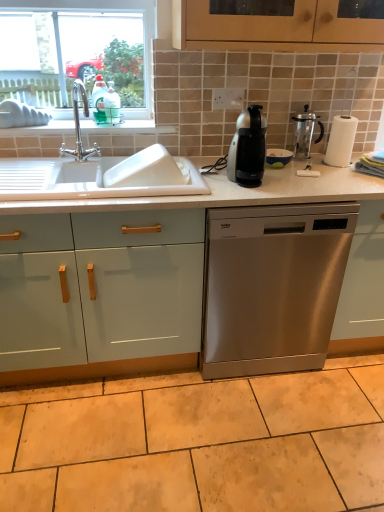
Describe the element at coordinates (199, 443) in the screenshot. I see `beige ceramic tile at lower center` at that location.

You are a GUI agent. You are given a task and a screenshot of the screen. Output one action in this format:
    pyautogui.click(x=<x>, y=<y>)
    Task: Click on the translucent plastic bottle at upper left
    The width and height of the screenshot is (384, 512).
    Given the screenshot: What is the action you would take?
    pyautogui.click(x=105, y=102)

Where is `mint glossy cabinet doors at lower left`? mint glossy cabinet doors at lower left is located at coordinates (100, 295).

Considering the relative sizes of translucent plastic bottle at upper left and clear glass window at upper left in the image provided, is translucent plastic bottle at upper left wider than clear glass window at upper left?

Indeed, translucent plastic bottle at upper left has a greater width compared to clear glass window at upper left.

Can you confirm if translucent plastic bottle at upper left is shorter than clear glass window at upper left?

Yes, translucent plastic bottle at upper left is shorter than clear glass window at upper left.

Is point (94, 99) more distant than point (52, 71)?

No.

Are translucent plastic bottle at upper left and clear glass window at upper left making contact?

No, translucent plastic bottle at upper left is not making contact with clear glass window at upper left.

Between metallic glass carafe at upper right and satin black coffee machine at center, which one has less height?

metallic glass carafe at upper right.

Is metallic glass carafe at upper right touching satin black coffee machine at center?

metallic glass carafe at upper right and satin black coffee machine at center are not in contact.

In the scene shown: Which is closer, (297, 151) or (242, 144)?

The point (242, 144) is in front.

From a real-world perspective, between mint glossy cabinet doors at lower left and translucent plastic bottle at upper left, who is vertically higher?

In real-world perspective, translucent plastic bottle at upper left is above.

Is there a large distance between mint glossy cabinet doors at lower left and translucent plastic bottle at upper left?

No, mint glossy cabinet doors at lower left is not far from translucent plastic bottle at upper left.

Is mint glossy cabinet doors at lower left behind translucent plastic bottle at upper left?

No, it is not.

The image size is (384, 512). Find the location of `teal above the mint glossy cabinet doors at lower left (from a real-world perspective)`. teal above the mint glossy cabinet doors at lower left (from a real-world perspective) is located at coordinates (105, 102).

Is mint glossy cabinet doors at lower left at the back of translucent plastic bottle at upper left?

No.

Considering the relative sizes of translucent plastic bottle at upper left and mint glossy cabinet doors at lower left in the image provided, is translucent plastic bottle at upper left wider than mint glossy cabinet doors at lower left?

A: No, translucent plastic bottle at upper left is not wider than mint glossy cabinet doors at lower left.

From a real-world perspective, is translucent plastic bottle at upper left positioned above or below mint glossy cabinet doors at lower left?

Clearly, from a real-world perspective, translucent plastic bottle at upper left is above mint glossy cabinet doors at lower left.

Are clear glass window at upper left and translucent plastic bottle at upper left beside each other?

clear glass window at upper left and translucent plastic bottle at upper left are clearly separated.

Is clear glass window at upper left facing towards translucent plastic bottle at upper left?

Yes.

Which is behind, clear glass window at upper left or translucent plastic bottle at upper left?

translucent plastic bottle at upper left is behind.

Which is farther from the camera, (317, 118) or (64, 239)?

The point (317, 118) is farther from the camera.

Does metallic glass carafe at upper right have a lesser height compared to mint glossy cabinet doors at lower left?

Indeed, metallic glass carafe at upper right has a lesser height compared to mint glossy cabinet doors at lower left.

Are metallic glass carafe at upper right and mint glossy cabinet doors at lower left located far from each other?

That's right, there is a large distance between metallic glass carafe at upper right and mint glossy cabinet doors at lower left.

Is metallic glass carafe at upper right positioned beyond the bounds of mint glossy cabinet doors at lower left?

Absolutely, metallic glass carafe at upper right is external to mint glossy cabinet doors at lower left.

Which object is closer to the camera taking this photo, mint glossy cabinet doors at lower left or beige ceramic tile at lower center?

beige ceramic tile at lower center.

From the image's perspective, between mint glossy cabinet doors at lower left and beige ceramic tile at lower center, who is located below?

beige ceramic tile at lower center is shown below in the image.

Considering the relative positions of mint glossy cabinet doors at lower left and beige ceramic tile at lower center in the image provided, is mint glossy cabinet doors at lower left to the right of beige ceramic tile at lower center from the viewer's perspective?

Incorrect, mint glossy cabinet doors at lower left is not on the right side of beige ceramic tile at lower center.

Is mint glossy cabinet doors at lower left facing towards beige ceramic tile at lower center?

Yes, mint glossy cabinet doors at lower left is aimed at beige ceramic tile at lower center.

Locate an element on the screen. Image resolution: width=384 pixels, height=512 pixels. window that is in front of the translucent plastic bottle at upper left is located at coordinates (76, 35).

Find the location of `home appliance lying on the left of metallic glass carafe at upper right`. home appliance lying on the left of metallic glass carafe at upper right is located at coordinates (248, 148).

When comparing their distances from clear glass window at upper left, does translucent plastic bottle at upper left or beige ceramic tile at lower center seem further?

beige ceramic tile at lower center lies further to clear glass window at upper left than the other object.

Looking at the image, which one is located closer to satin black coffee machine at center, polished chrome faucet at upper left or beige ceramic tile at lower center?

Based on the image, polished chrome faucet at upper left appears to be nearer to satin black coffee machine at center.

Estimate the real-world distances between objects in this image. Which object is closer to satin black coffee machine at center, metallic glass carafe at upper right or mint glossy cabinet doors at lower left?

Based on the image, metallic glass carafe at upper right appears to be nearer to satin black coffee machine at center.

Looking at this image, based on their spatial positions, is stainless steel dishwasher at center or mint glossy cabinet doors at lower left closer to metallic glass carafe at upper right?

stainless steel dishwasher at center is positioned closer to the anchor metallic glass carafe at upper right.

When comparing their distances from translucent plastic bottle at upper left, does clear glass window at upper left or beige ceramic tile at lower center seem closer?

The object closer to translucent plastic bottle at upper left is clear glass window at upper left.

Estimate the real-world distances between objects in this image. Which object is further from polished chrome faucet at upper left, metallic glass carafe at upper right or mint glossy cabinet doors at lower left?

metallic glass carafe at upper right is further to polished chrome faucet at upper left.

Which object lies further to the anchor point polished chrome faucet at upper left, beige ceramic tile at lower center or metallic glass carafe at upper right?

beige ceramic tile at lower center is positioned further to the anchor polished chrome faucet at upper left.

Based on their spatial positions, is beige ceramic tile at lower center or polished chrome faucet at upper left further from clear glass window at upper left?

Based on the image, beige ceramic tile at lower center appears to be further to clear glass window at upper left.

Identify the location of home appliance situated between polished chrome faucet at upper left and stainless steel dishwasher at center from left to right. This screenshot has height=512, width=384. (248, 148).

This screenshot has width=384, height=512. What are the coordinates of `dishwasher between clear glass window at upper left and mint glossy cabinet doors at lower left in the up-down direction` in the screenshot? It's located at (272, 286).

The height and width of the screenshot is (512, 384). Identify the location of home appliance between metallic glass carafe at upper right and beige ceramic tile at lower center in the vertical direction. (248, 148).

In order to click on teal that lies between clear glass window at upper left and polished chrome faucet at upper left from top to bottom in this screenshot , I will do `click(105, 102)`.